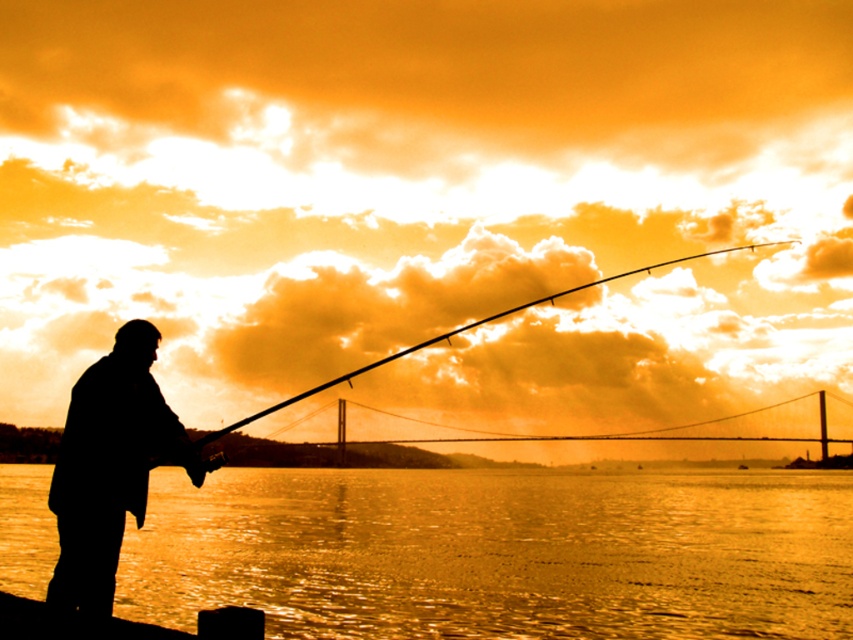
Does golden reflective water at lower center appear over silhouette fishing rod at left?

Actually, golden reflective water at lower center is below silhouette fishing rod at left.

Who is positioned more to the right, golden reflective water at lower center or silhouette fishing rod at left?

Positioned to the right is golden reflective water at lower center.

Does point (656, 525) lie in front of point (53, 604)?

No, it is behind (53, 604).

I want to click on golden reflective water at lower center, so click(x=497, y=552).

Based on the photo, does silhouette fishing rod at left have a greater height compared to smooth wood dock at lower left?

Yes, silhouette fishing rod at left is taller than smooth wood dock at lower left.

Which is in front, point (83, 416) or point (68, 628)?

Point (68, 628)

Is point (114, 492) positioned after point (221, 632)?

Yes, it is behind point (221, 632).

This screenshot has width=853, height=640. Find the location of `silhouette fishing rod at left`. silhouette fishing rod at left is located at coordinates (109, 467).

Is point (260, 632) positioned after point (291, 397)?

That is False.

Does smooth wood dock at lower left have a greater width compared to smooth black rod at center?

No.

Does point (33, 616) lie behind point (675, 259)?

No, it is not.

At what (x,y) coordinates should I click in order to perform the action: click on smooth wood dock at lower left. Please return your answer as a coordinate pair (x, y). This screenshot has height=640, width=853. Looking at the image, I should click on (119, 624).